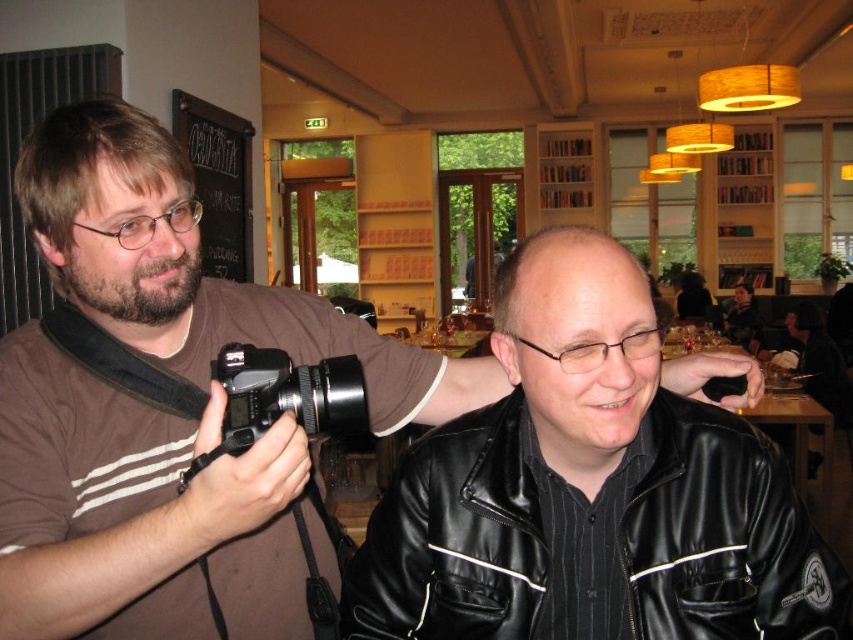
Question: Is black plastic camera at center to the left of black leather jacket at center from the viewer's perspective?

Choices:
 (A) no
 (B) yes

Answer: (B)

Question: Based on their relative distances, which object is nearer to the black leather jacket at lower right?

Choices:
 (A) black leather jacket at center
 (B) black plastic camera at center

Answer: (B)

Question: Which point is closer to the camera?

Choices:
 (A) (422, 509)
 (B) (750, 349)

Answer: (A)

Question: Is black leather jacket at lower right bigger than black plastic camera at center?

Choices:
 (A) no
 (B) yes

Answer: (B)

Question: Which of the following is the closest to the observer?

Choices:
 (A) (726, 609)
 (B) (305, 406)
 (C) (753, 316)

Answer: (B)

Question: Can you confirm if black leather jacket at lower right is positioned to the left of black leather jacket at center?

Choices:
 (A) no
 (B) yes

Answer: (B)